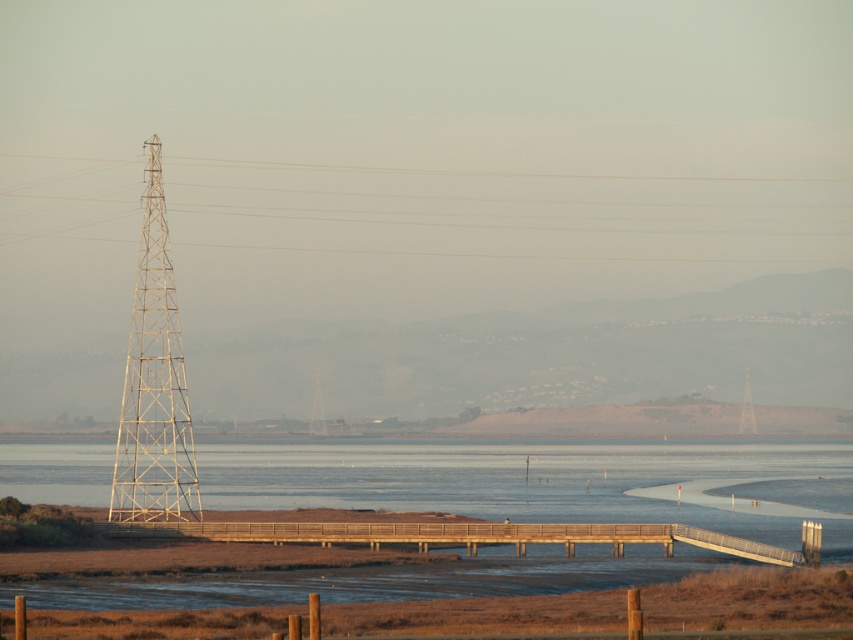
You are a surveyor measuring distances between landmarks. You need to determine if a 100 meter long rope can stretch from the metallic tower at right to the clear water at center. Based on the scene, will the rope be long enough?

The distance between the metallic tower at right and the clear water at center is 86.17 meters. Since the rope is 100 meters long, it will be long enough to stretch between them.

You are a photographer aiming to capture both the metallic lattice tower at left and the metallic silver tower at left in a single frame. Since both are on the left side of the image, which one should you position closer to the center to ensure they are both visible in the photo?

The metallic lattice tower at left is positioned on the left side of metallic silver tower at left, so to include both in the frame, you should position the metallic silver tower at left closer to the center. This way, the metallic lattice tower at left will be slightly to the left of center, while the metallic silver tower at left remains centered, ensuring both are visible.

You are standing on the wooden walkway in the foreground of the scene. You see two points marked on the walkway, one at coordinates point [123,497] and another at point [755,429]. If you were to walk towards the transmission tower on the left, which point would you encounter first?

Point [123,497] is in front of point [755,429], so you would encounter point [123,497] first when walking towards the transmission tower on the left.